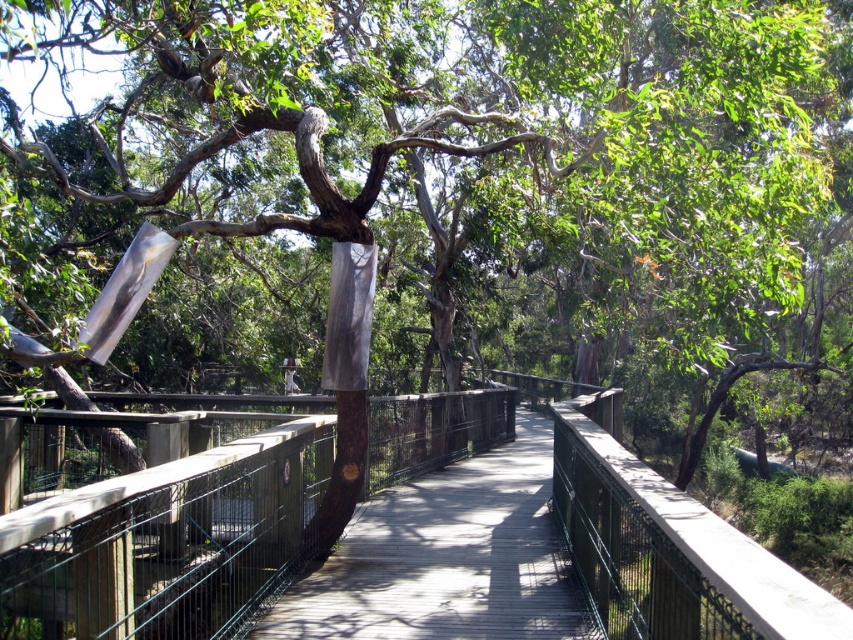
Is wooden bridge at center smaller than wooden walkway at center?

Actually, wooden bridge at center might be larger than wooden walkway at center.

Does wooden bridge at center have a greater width compared to wooden walkway at center?

Yes.

I want to click on wooden bridge at center, so click(x=167, y=540).

Locate an element on the screen. wooden bridge at center is located at coordinates (167, 540).